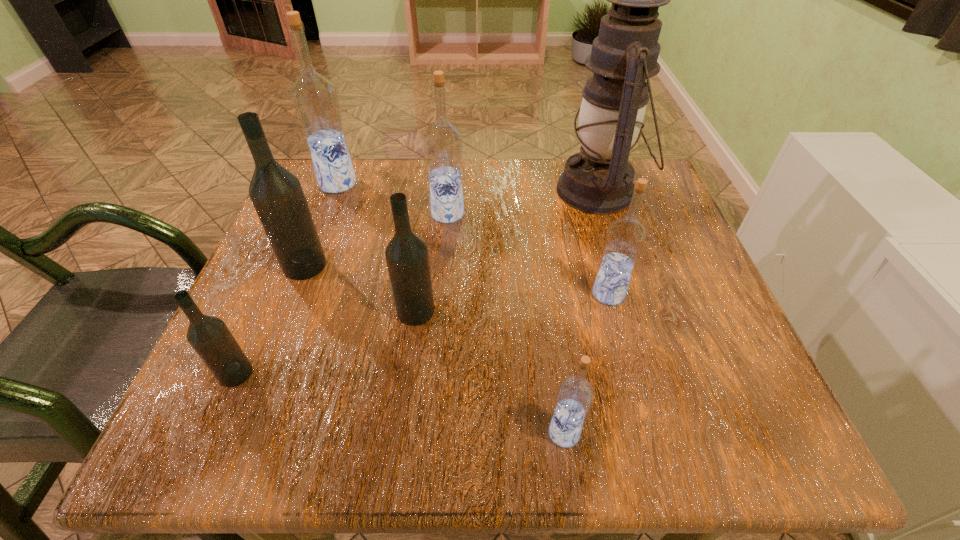
You are a GUI agent. You are given a task and a screenshot of the screen. Output one action in this format:
    pyautogui.click(x=<x>, y=<y>)
    Task: Click on the free spot between the biggest black vodka and the blue oil lamp
    
    Given the screenshot: What is the action you would take?
    pyautogui.click(x=452, y=228)

Find the location of a particular element. The width and height of the screenshot is (960, 540). vacant region between the fourth farthest object and the farthest vodka is located at coordinates (322, 225).

Where is `free space between the second farthest black vodka and the third biggest blue vodka`? Image resolution: width=960 pixels, height=540 pixels. free space between the second farthest black vodka and the third biggest blue vodka is located at coordinates (513, 303).

Locate an element on the screen. empty location between the second biggest blue vodka and the second blue vodka from right to left is located at coordinates (506, 323).

At what (x,y) coordinates should I click in order to perform the action: click on vacant space that is in between the smallest black vodka and the fifth nearest object. Please return your answer as a coordinate pair (x, y). This screenshot has width=960, height=540. Looking at the image, I should click on (271, 320).

Select which object is the seventh closest to the third farthest vodka. Please provide its 2D coordinates. Your answer should be formatted as a tuple, i.e. [(x, y)], where the tuple contains the x and y coordinates of a point satisfying the conditions above.

[(626, 236)]

Identify which object is located as the third nearest to the third nearest blue vodka. Please provide its 2D coordinates. Your answer should be formatted as a tuple, i.e. [(x, y)], where the tuple contains the x and y coordinates of a point satisfying the conditions above.

[(277, 195)]

Locate an element on the screen. vodka object that ranks as the fourth closest to the sixth farthest vodka is located at coordinates (315, 99).

Locate which vodka is the third closest to the rightmost vodka. Please provide its 2D coordinates. Your answer should be formatted as a tuple, i.e. [(x, y)], where the tuple contains the x and y coordinates of a point satisfying the conditions above.

[(443, 141)]

I want to click on blue vodka that is the second closest to the second blue vodka from left to right, so click(626, 236).